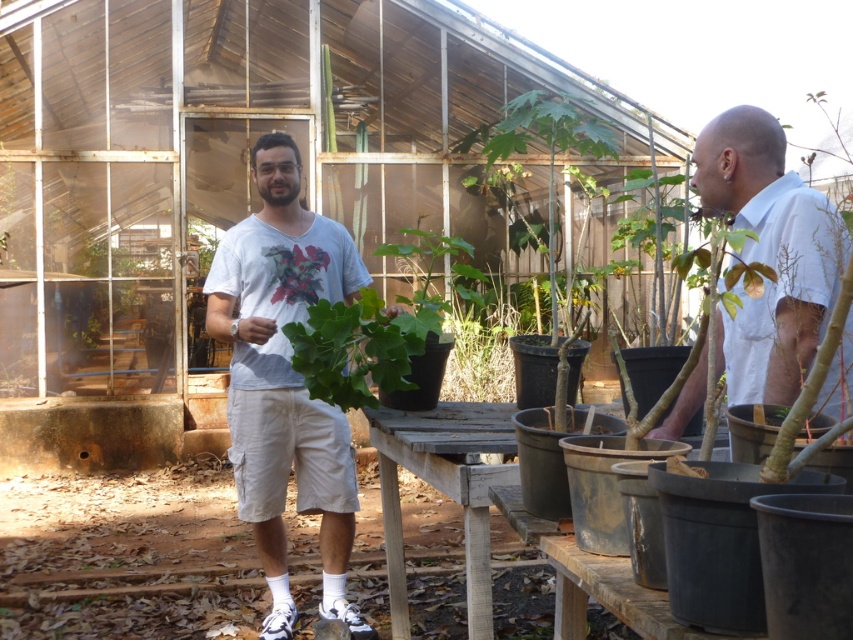
You are navigating through the garden and need to reach a specific location marked by point [363,273]. You are currently at point [770,362]. Based on the image, can you determine if the target point is behind your current position?

Yes, the point [363,273] is behind your current position at point [770,362] according to the spatial arrangement in the image.